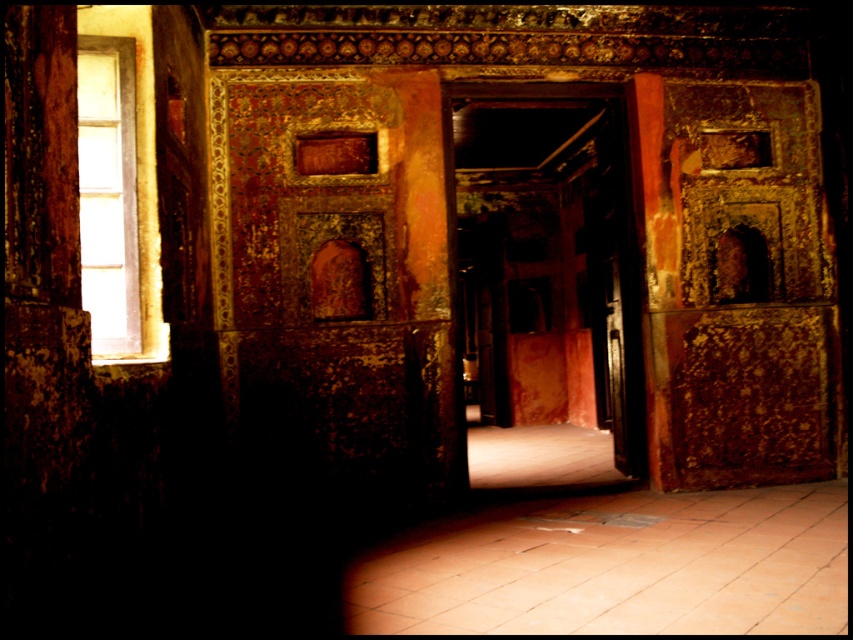
Question: Which point appears closest to the camera in this image?

Choices:
 (A) (618, 358)
 (B) (149, 234)

Answer: (B)

Question: In this image, where is clear glass window at left located relative to metallic polished door at center?

Choices:
 (A) below
 (B) above

Answer: (B)

Question: Which object appears closest to the camera in this image?

Choices:
 (A) clear glass window at left
 (B) metallic polished door at center

Answer: (A)

Question: Is clear glass window at left above metallic polished door at center?

Choices:
 (A) no
 (B) yes

Answer: (B)

Question: Does clear glass window at left appear on the right side of metallic polished door at center?

Choices:
 (A) yes
 (B) no

Answer: (B)